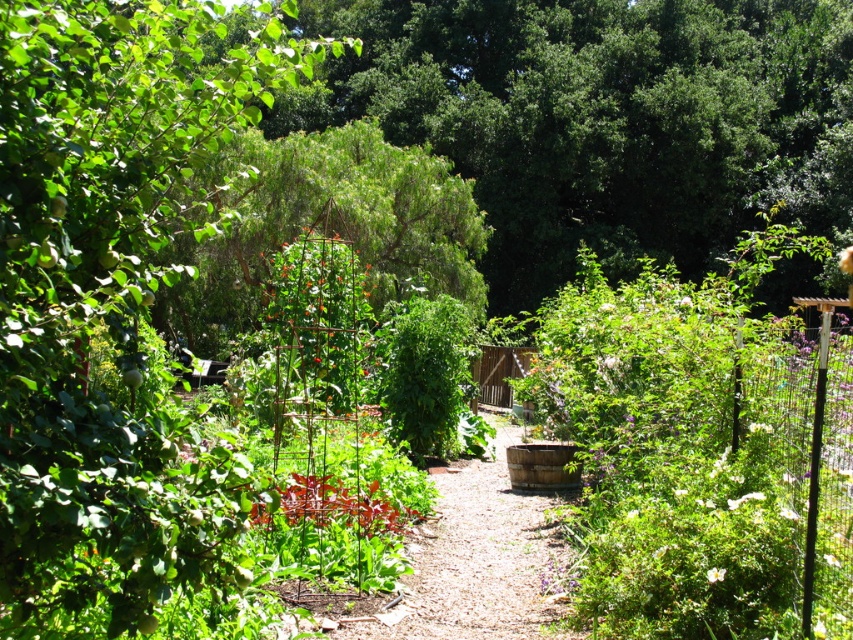
You are standing at point [326,227] in the garden. What can you see around you?

At point 0.353, 0.383 lies green leafy tree at center.

You are a gardener who needs to install a new sprinkler system between the green leafy tree at upper left and the green leafy tree at center. The sprinkler requires a minimum of 5 meters of space between the trees to function properly. Based on the garden layout, will the sprinkler system fit in the available space?

The green leafy tree at upper left and green leafy tree at center are 4.60 meters apart from each other. Since the required minimum space is 5 meters, the sprinkler system will not fit in the available space.